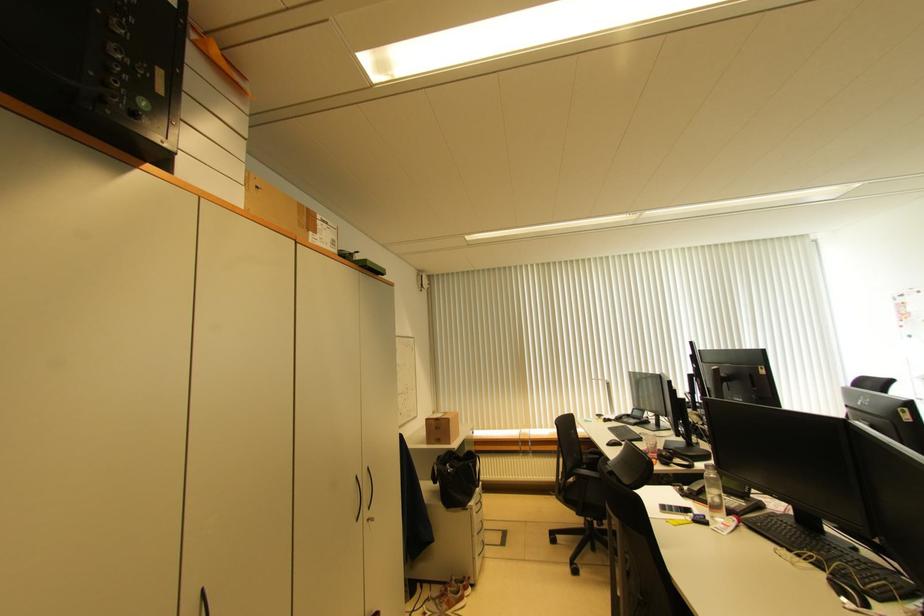
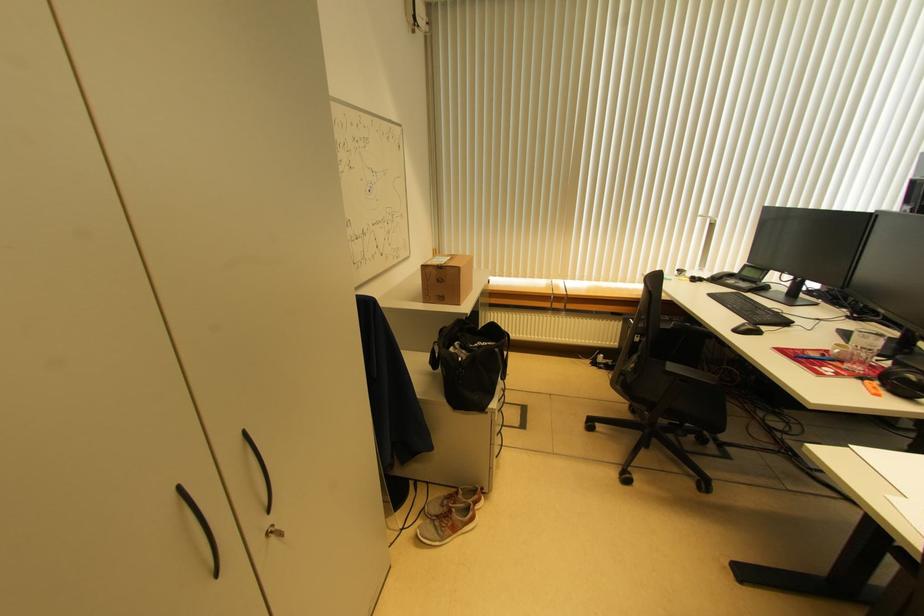
Question: I am providing you with two images of the same scene from different viewpoints. Please identify which objects are invisible in image2.

Choices:
 (A) grey and orange shoe
 (B) chair armrest
 (C) dark cabinet handle
 (D) none of these

Answer: (D)